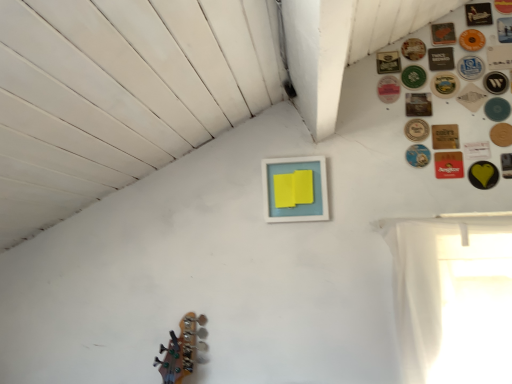
Question: Is white paper button at upper right, the fifteenth button viewed from the top, positioned far away from wooden coaster at upper right, which ranks as the 20th button in bottom-to-top order?

Choices:
 (A) yes
 (B) no

Answer: (B)

Question: From the image's perspective, is white paper button at upper right, which is the eleventh button in bottom-to-top order, below wooden coaster at upper right, which ranks as the 20th button in bottom-to-top order?

Choices:
 (A) yes
 (B) no

Answer: (A)

Question: Is white paper button at upper right, the fifteenth button viewed from the top, in contact with wooden coaster at upper right, which ranks as the 20th button in bottom-to-top order?

Choices:
 (A) no
 (B) yes

Answer: (A)

Question: Is white paper button at upper right, the fifteenth button viewed from the top, closer to the viewer compared to wooden coaster at upper right, which ranks as the sixth button in top-to-bottom order?

Choices:
 (A) yes
 (B) no

Answer: (A)

Question: From the image's perspective, would you say white paper button at upper right, which is the eleventh button in bottom-to-top order, is positioned over wooden coaster at upper right, which ranks as the 20th button in bottom-to-top order?

Choices:
 (A) no
 (B) yes

Answer: (A)

Question: From a real-world perspective, is white paper button at upper right, which is the eleventh button in bottom-to-top order, over wooden coaster at upper right, which ranks as the 20th button in bottom-to-top order?

Choices:
 (A) no
 (B) yes

Answer: (A)

Question: Can you confirm if matte blue picture frame at center is smaller than matte black button at upper right, which appears as the seventh button when viewed from the top?

Choices:
 (A) yes
 (B) no

Answer: (B)

Question: Can you confirm if matte blue picture frame at center is bigger than matte black button at upper right, which is counted as the nineteenth button, starting from the bottom?

Choices:
 (A) no
 (B) yes

Answer: (B)

Question: Is matte black button at upper right, which appears as the seventh button when viewed from the top, located within matte blue picture frame at center?

Choices:
 (A) no
 (B) yes

Answer: (A)

Question: From the image's perspective, is matte blue picture frame at center above matte black button at upper right, which appears as the seventh button when viewed from the top?

Choices:
 (A) no
 (B) yes

Answer: (A)

Question: Is matte blue picture frame at center closer to the viewer compared to matte black button at upper right, which appears as the seventh button when viewed from the top?

Choices:
 (A) no
 (B) yes

Answer: (B)

Question: Is matte blue picture frame at center turned away from matte black button at upper right, which appears as the seventh button when viewed from the top?

Choices:
 (A) no
 (B) yes

Answer: (A)

Question: Is wooden coaster at upper right, acting as the twentieth button starting from the top, smaller than wooden circular coaster at upper right, placed as the 23th button when sorted from bottom to top?

Choices:
 (A) yes
 (B) no

Answer: (A)